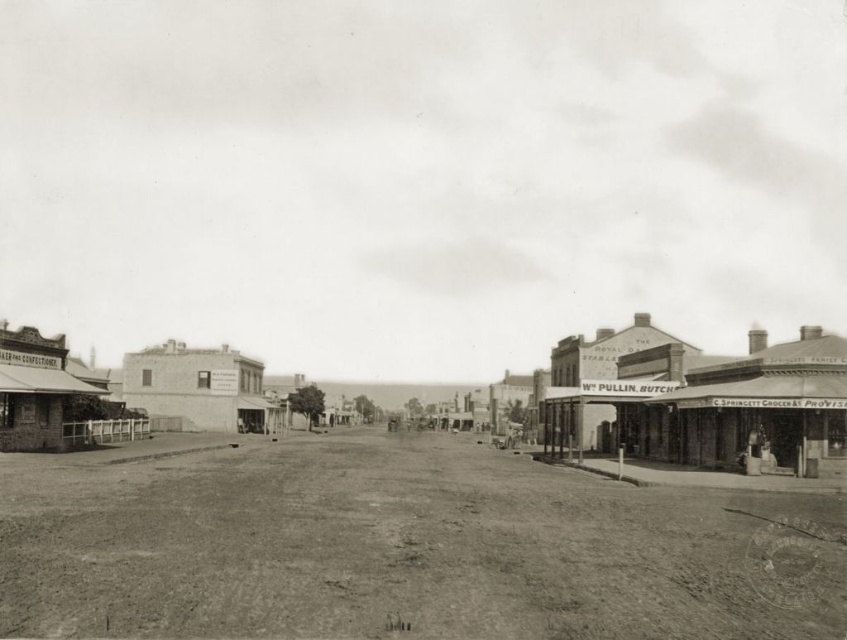
You are standing at the camera position in the historical street scene. You see two points marked in the image. The first point is at coordinates point (x=1, y=632) and the second point is at point (x=829, y=458). Which point is closer to you?

Point (x=1, y=632) is closer to the camera than point (x=829, y=458).

You are a traveler on a horse and carriage. You see a dirt track at center and a smooth concrete street at center. Which path should you take if you want to go uphill?

The dirt track at center is located below the smooth concrete street at center, so to go uphill, you should take the smooth concrete street at center since it is higher.

You are a cyclist planning to ride through the historical street scene. You notice the dirt track at center and the smooth concrete street at center. Which path should you choose if you want to stay on the left side of the road?

You should choose the dirt track at center because it is located to the left of the smooth concrete street at center, aligning with your intention to stay on the left side of the road.